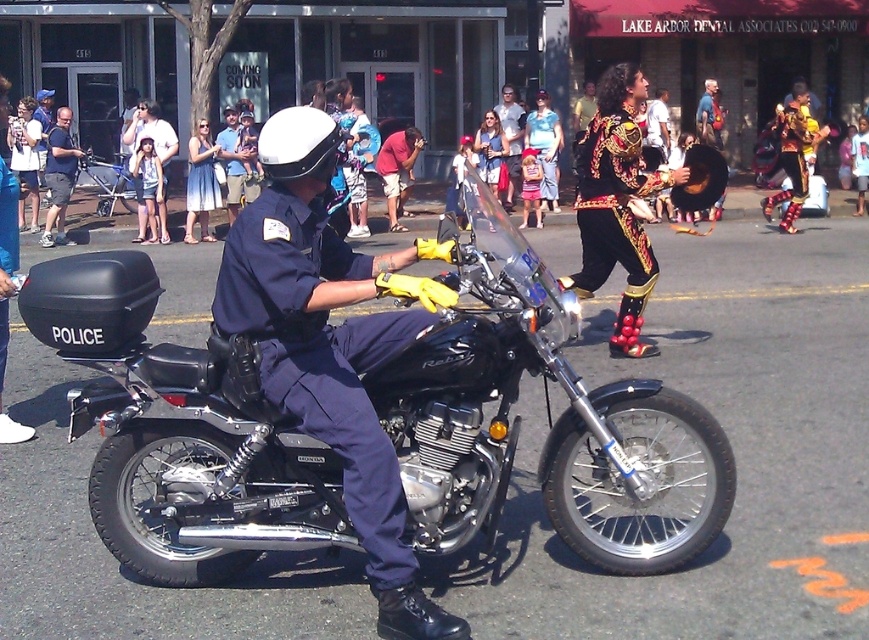
Is black matte police motorcycle at center further to camera compared to blue cotton dress at upper left?

No.

Does black matte police motorcycle at center appear on the right side of blue cotton dress at upper left?

Yes, black matte police motorcycle at center is to the right of blue cotton dress at upper left.

The height and width of the screenshot is (640, 869). Identify the location of black matte police motorcycle at center. [549, 422].

Is navy blue uniform at center behind shiny gold costume at center?

No, it is in front of shiny gold costume at center.

Between point (276, 208) and point (514, 144), which one is positioned behind?

Point (514, 144)

This screenshot has height=640, width=869. Find the location of `navy blue uniform at center`. navy blue uniform at center is located at coordinates (326, 348).

Does point (618, 193) come behind point (140, 182)?

That is False.

Can you confirm if black velvet costume at center is positioned below light blue denim shorts at left?

Correct, black velvet costume at center is located below light blue denim shorts at left.

I want to click on black velvet costume at center, so click(612, 204).